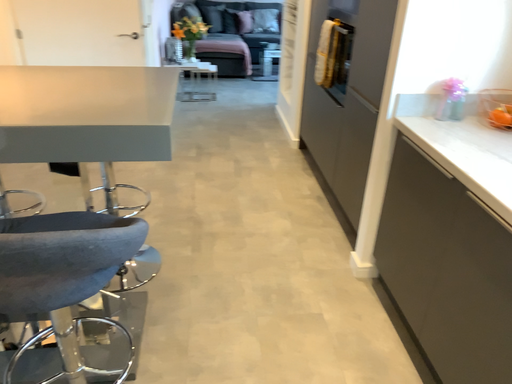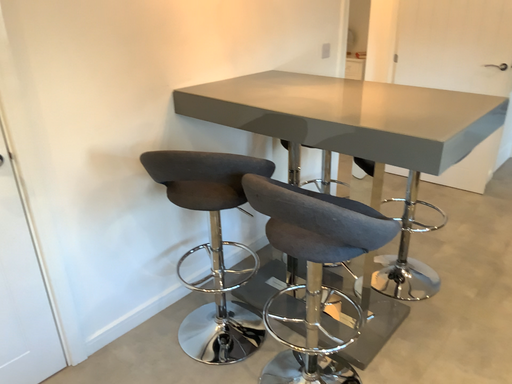
Question: Which way did the camera rotate in the video?

Choices:
 (A) rotated downward
 (B) rotated upward

Answer: (B)